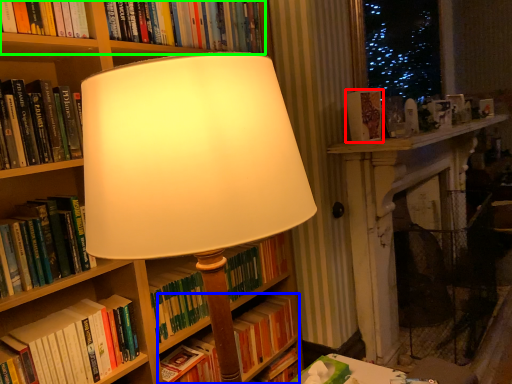
Question: Based on their relative distances, which object is farther from book (highlighted by a red box)? Choose from book (highlighted by a blue box) and book (highlighted by a green box).

Choices:
 (A) book
 (B) book

Answer: (A)